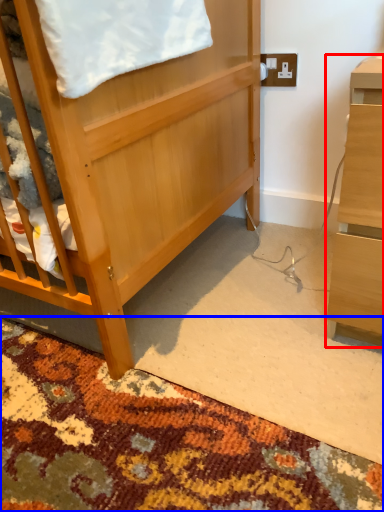
Question: Which object is further to the camera taking this photo, desk (highlighted by a red box) or mat (highlighted by a blue box)?

Choices:
 (A) desk
 (B) mat

Answer: (A)